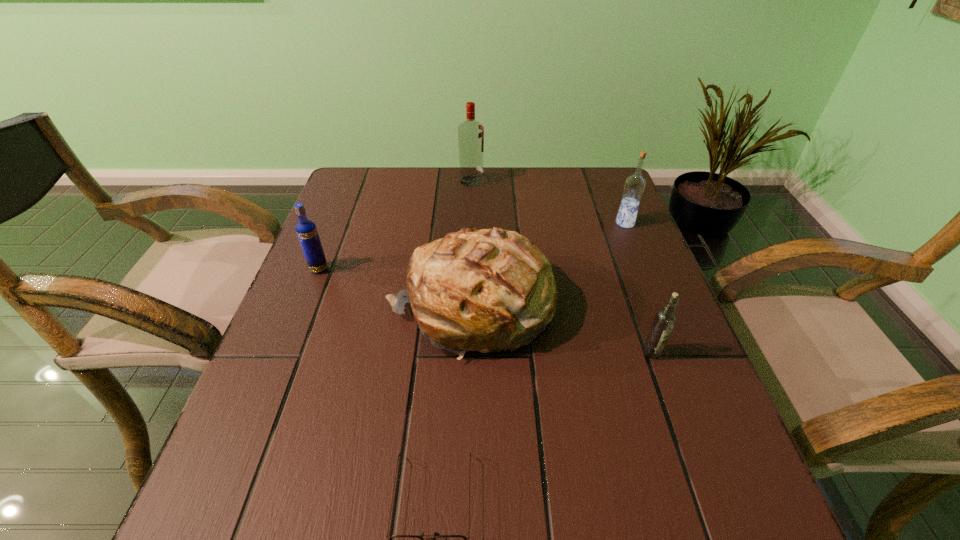
In the image, there is a desktop. Identify the location of vacant region at the far right corner. Image resolution: width=960 pixels, height=540 pixels. (574, 186).

At what (x,y) coordinates should I click in order to perform the action: click on empty location between the bread and the nearest vodka. Please return your answer as a coordinate pair (x, y). Looking at the image, I should click on (561, 330).

I want to click on object that can be found as the fourth closest to the second nearest vodka, so click(x=664, y=321).

This screenshot has width=960, height=540. I want to click on object that is the closest to the rightmost object, so click(486, 290).

Select which vodka appears as the third closest to the nearest vodka. Please provide its 2D coordinates. Your answer should be formatted as a tuple, i.e. [(x, y)], where the tuple contains the x and y coordinates of a point satisfying the conditions above.

[(306, 230)]

Choose which vodka is the third nearest neighbor to the rightmost vodka. Please provide its 2D coordinates. Your answer should be formatted as a tuple, i.e. [(x, y)], where the tuple contains the x and y coordinates of a point satisfying the conditions above.

[(306, 230)]

You are a GUI agent. You are given a task and a screenshot of the screen. Output one action in this format:
    pyautogui.click(x=<x>, y=<y>)
    Task: Click on the free space that satisfies the following two spatial constraints: 1. on the front label of the bread; 2. on the right side of the farthest object
    This screenshot has height=540, width=960.
    Given the screenshot: What is the action you would take?
    pyautogui.click(x=468, y=307)

Image resolution: width=960 pixels, height=540 pixels. I want to click on vacant area that satisfies the following two spatial constraints: 1. on the front label of the second vodka from left to right; 2. on the left side of the third nearest vodka, so click(470, 223).

The width and height of the screenshot is (960, 540). What are the coordinates of `free location that satisfies the following two spatial constraints: 1. on the front label of the farthest object; 2. on the right side of the bread` in the screenshot? It's located at (468, 307).

You are a GUI agent. You are given a task and a screenshot of the screen. Output one action in this format:
    pyautogui.click(x=<x>, y=<y>)
    Task: Click on the vacant space that satisfies the following two spatial constraints: 1. on the front label of the farthest object; 2. on the left side of the third nearest vodka
    This screenshot has height=540, width=960.
    Given the screenshot: What is the action you would take?
    pyautogui.click(x=470, y=223)